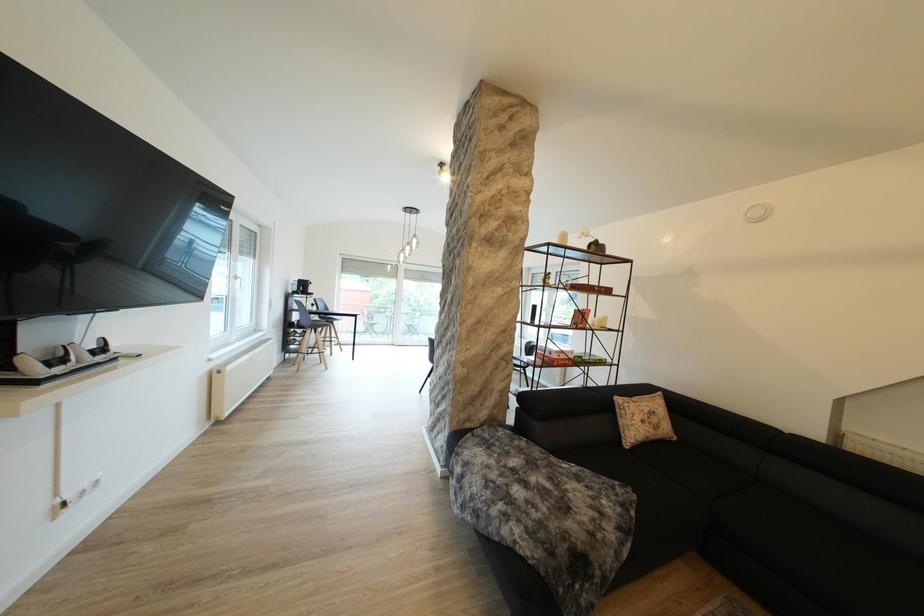
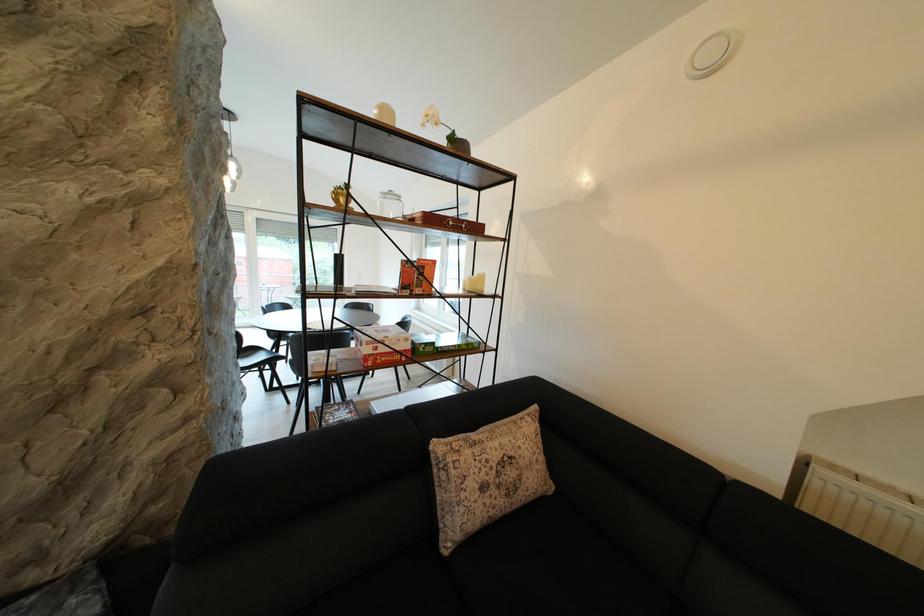
Consider the image. In a continuous first-person perspective shot, in which direction is the camera moving?

The movement direction of the cameraman is right, forward.